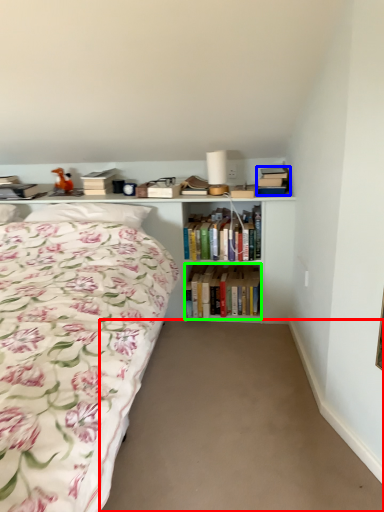
Question: Which is farther away from plain (highlighted by a red box)? book (highlighted by a blue box) or book (highlighted by a green box)?

Choices:
 (A) book
 (B) book

Answer: (A)